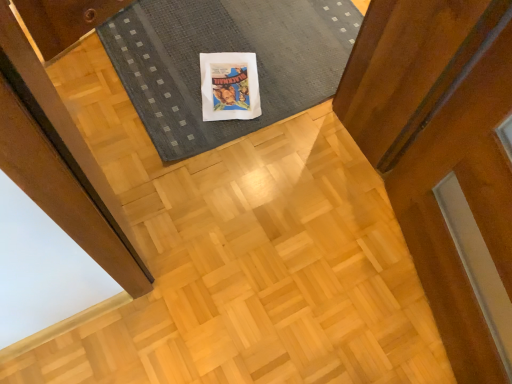
The width and height of the screenshot is (512, 384). In order to click on free space on the front side of dark gray textured mat at center in this screenshot , I will do coord(221,170).